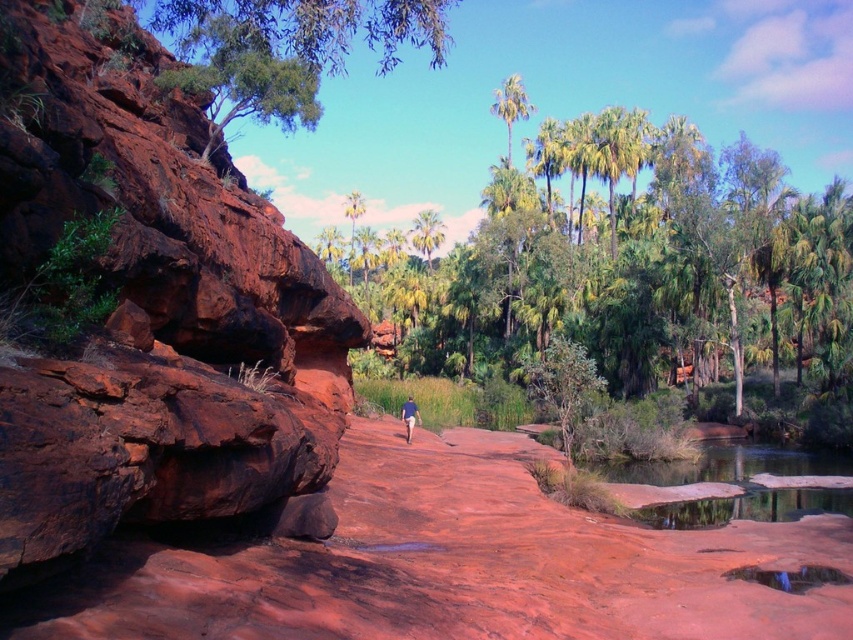
Which is below, rusty rock at left or reddish-brown rock at center?

reddish-brown rock at center is below.

Based on the photo, can you confirm if rusty rock at left is positioned to the left of reddish-brown rock at center?

Correct, you'll find rusty rock at left to the left of reddish-brown rock at center.

Is point (305, 296) more distant than point (410, 496)?

Yes, it is behind point (410, 496).

Identify the location of rusty rock at left. (146, 305).

Can you confirm if green leafy tree at center is wider than green leafy tree at upper left?

Correct, the width of green leafy tree at center exceeds that of green leafy tree at upper left.

Who is more forward, (563, 164) or (358, 0)?

Positioned in front is point (358, 0).

Locate an element on the screen. The image size is (853, 640). green leafy tree at center is located at coordinates (624, 268).

Based on the photo, between green leafy tree at upper left and blue fabric hiker at center, which one has more height?

With more height is green leafy tree at upper left.

Does green leafy tree at upper left lie behind blue fabric hiker at center?

That is False.

Measure the distance between point (x=196, y=12) and camera.

Point (x=196, y=12) and camera are 10.51 meters apart.

You are a GUI agent. You are given a task and a screenshot of the screen. Output one action in this format:
    pyautogui.click(x=<x>, y=<y>)
    Task: Click on the green leafy tree at upper left
    The image size is (853, 640).
    Given the screenshot: What is the action you would take?
    click(x=292, y=45)